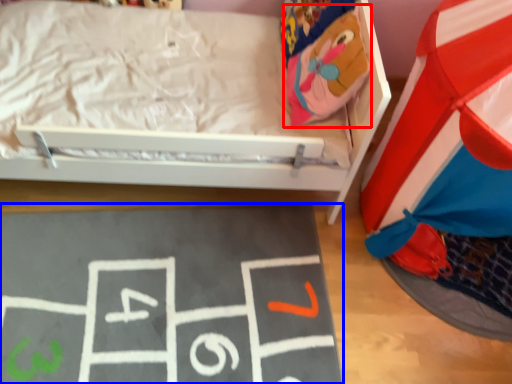
Question: Among these objects, which one is nearest to the camera, bean bag chair (highlighted by a red box) or bulletin board (highlighted by a blue box)?

Choices:
 (A) bean bag chair
 (B) bulletin board

Answer: (B)